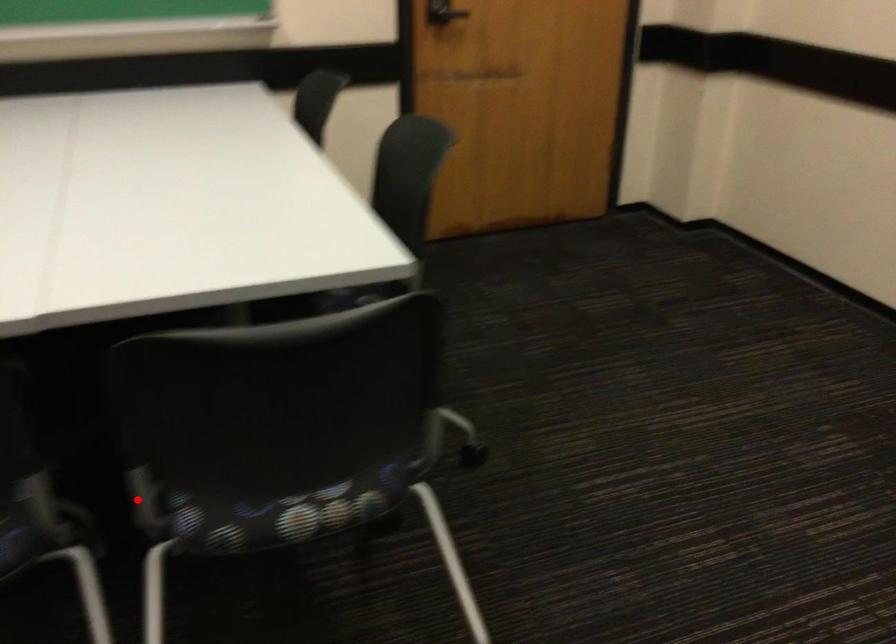
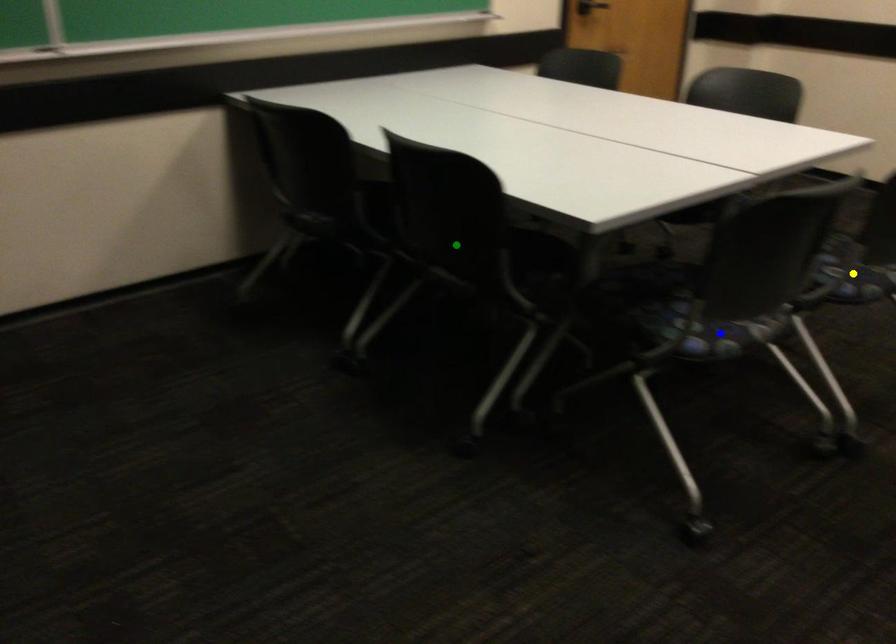
Question: I am providing you with two images of the same scene from different viewpoints. A red point is marked on the first image. You are given multiple points on the second image. Which point in image 2 is actually the same real-world point as the red point in image 1?

Choices:
 (A) yellow point
 (B) green point
 (C) blue point

Answer: (A)